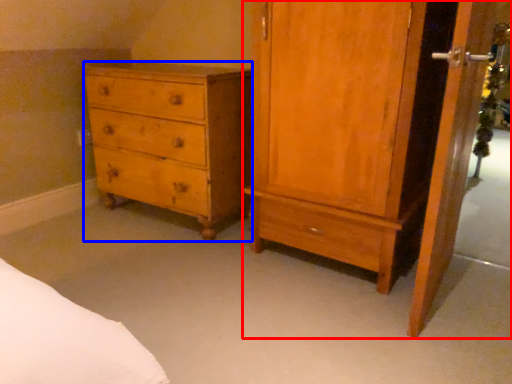
Question: Which point is further to the camera, nightstand (highlighted by a red box) or chest of drawers (highlighted by a blue box)?

Choices:
 (A) nightstand
 (B) chest of drawers

Answer: (B)